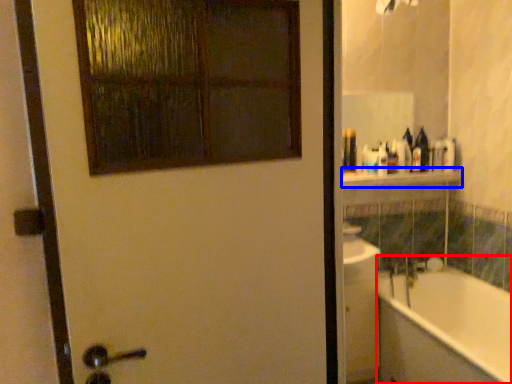
Question: Which object appears farthest to the camera in this image, bathtub (highlighted by a red box) or balustrade (highlighted by a blue box)?

Choices:
 (A) bathtub
 (B) balustrade

Answer: (B)